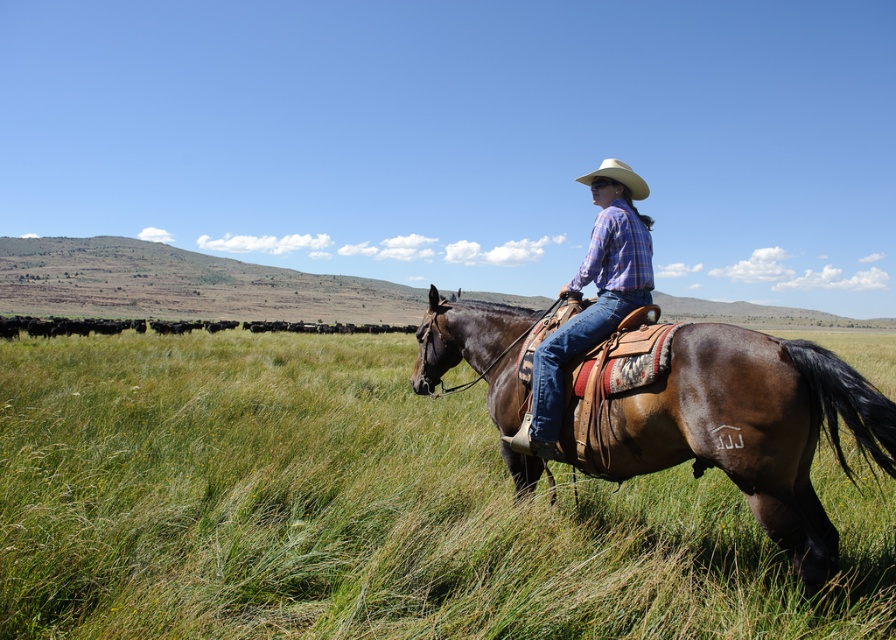
You are a photographer trying to capture the rider and their horse. You notice the plaid shirt at center and the straw hat at upper center. Which item is located lower in the image?

The plaid shirt at center is positioned under the straw hat at upper center, so the plaid shirt at center is lower in the image.

You are standing at the point labeled as point (x=547, y=561) in the image. A cow is approaching you from the direction of the rider on the dark brown horse. If the cow moves straight towards you, will it come from the left or right side of the rider?

The cow will come from the right side of the rider on the dark brown horse because the point is located to the right of the rider.

In the scene shown: You are standing at the point labeled as point (367,509) in the image. What is the name of the location you are currently standing on?

The point (367,509) corresponds to the green grassy field at center.